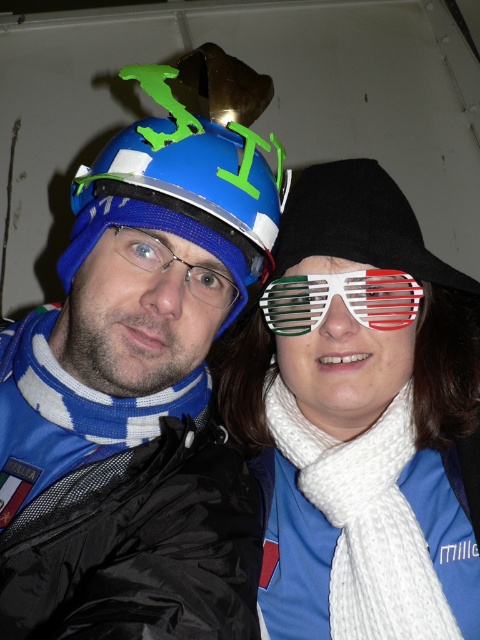
Question: Can you confirm if white knitted scarf at right is positioned to the left of black fabric hat at center?

Choices:
 (A) yes
 (B) no

Answer: (A)

Question: Which of the following is the closest to the observer?

Choices:
 (A) white plastic goggles at center
 (B) black fabric hat at center
 (C) blue matte helmet at left
 (D) white knitted scarf at center

Answer: (C)

Question: Estimate the real-world distances between objects in this image. Which object is farther from the white knitted scarf at center?

Choices:
 (A) matte blue helmet at left
 (B) white knitted scarf at right

Answer: (A)

Question: Can you confirm if matte blue helmet at left is positioned to the right of black fabric hat at center?

Choices:
 (A) yes
 (B) no

Answer: (B)

Question: Does white knitted scarf at center have a larger size compared to black fabric hat at center?

Choices:
 (A) no
 (B) yes

Answer: (B)

Question: Estimate the real-world distances between objects in this image. Which object is farther from the matte blue helmet at left?

Choices:
 (A) blue matte helmet at left
 (B) black fabric hat at center
 (C) white plastic goggles at center
 (D) white knitted scarf at center

Answer: (C)